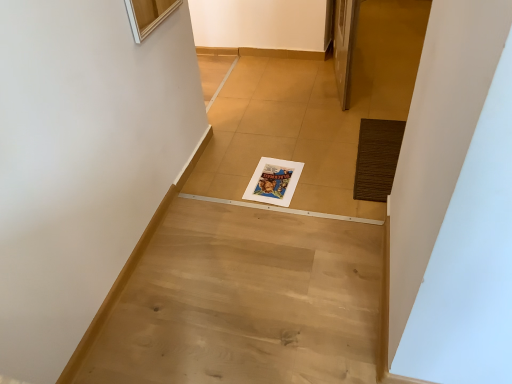
Identify the location of empty space that is ontop of white paper magazine at center (from a real-world perspective). (276, 181).